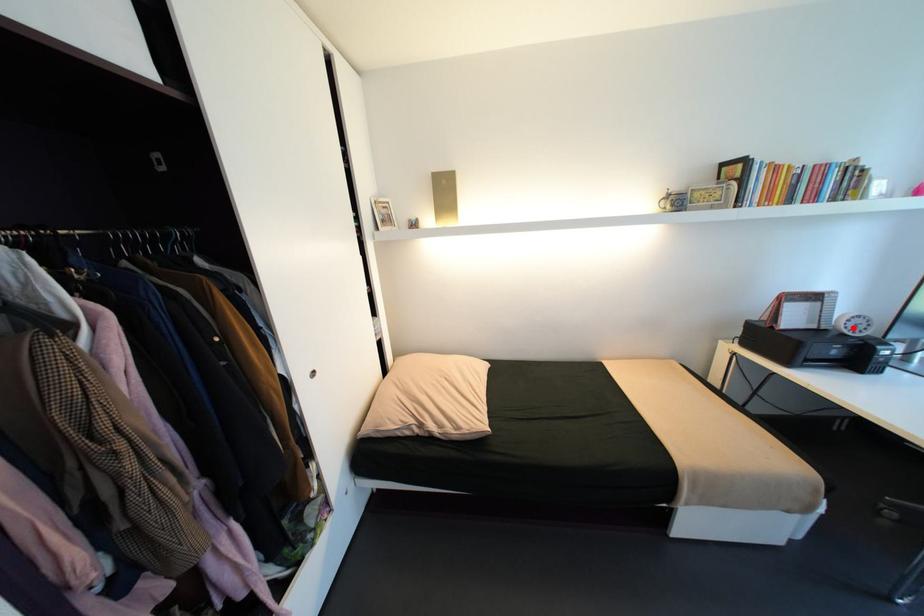
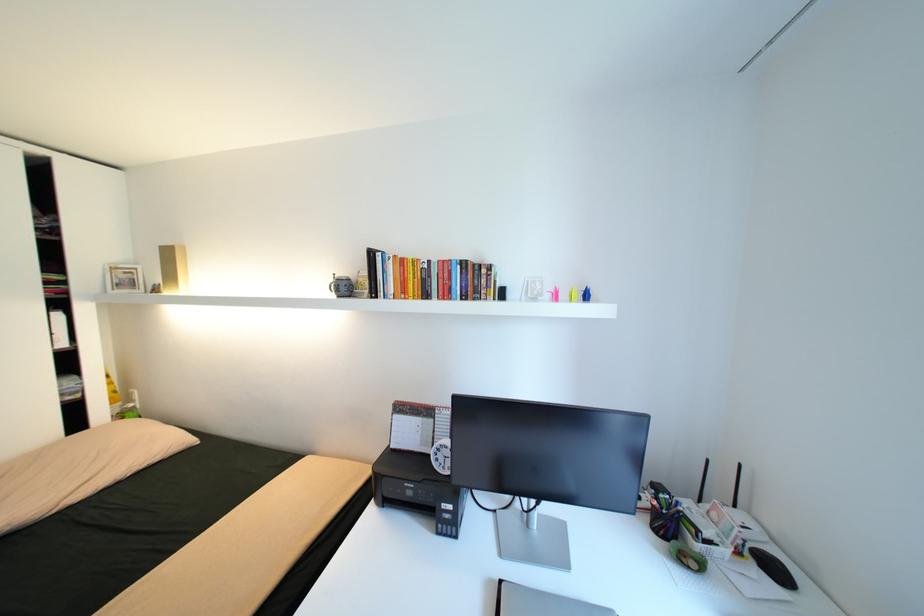
Question: I am providing you with two images of the same scene from different viewpoints. Image1 has a red point marked. In image2, the corresponding 3D location appears at what relative position? Reply with the corresponding letter.

Choices:
 (A) Closer
 (B) Farther

Answer: (B)